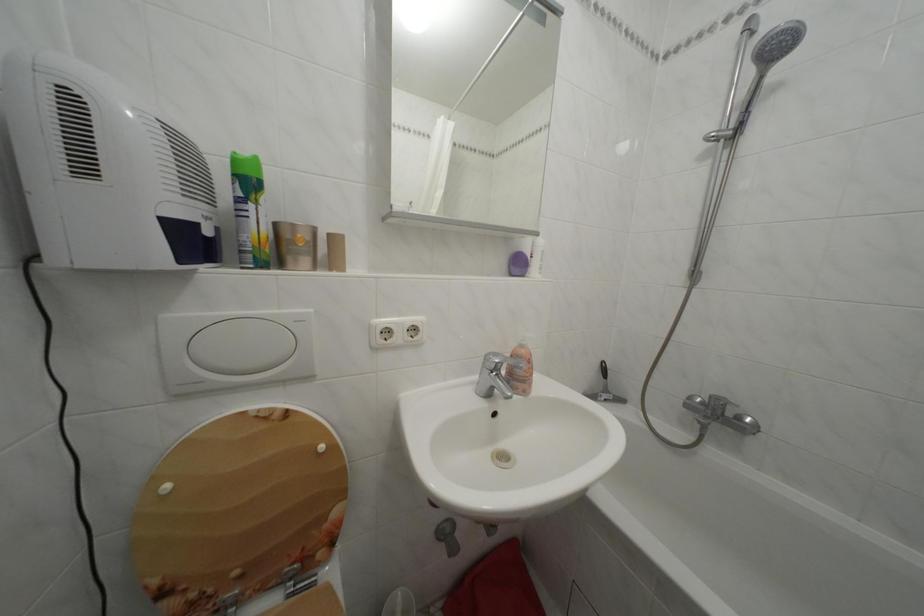
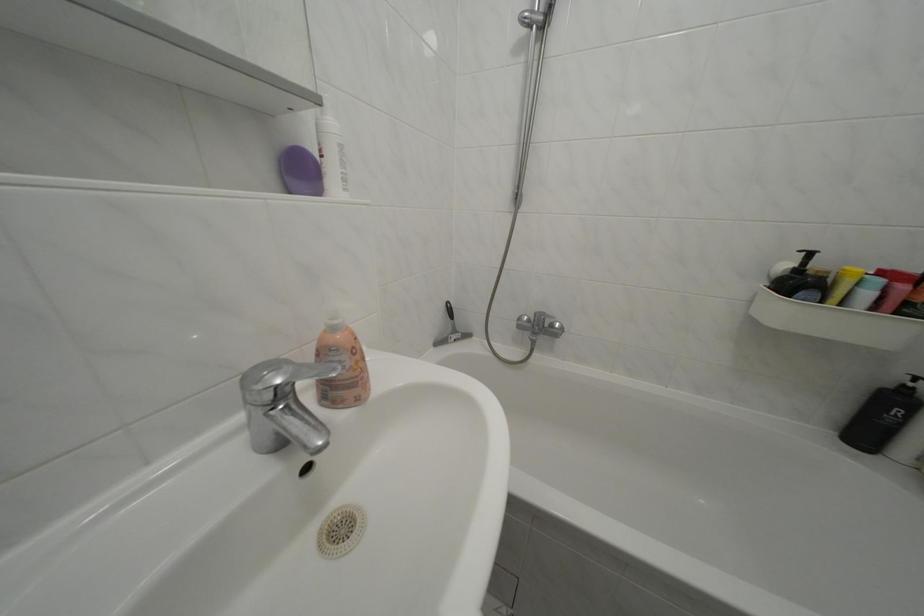
In the second image, find the point that corresponds to point (748, 424) in the first image.

(562, 331)